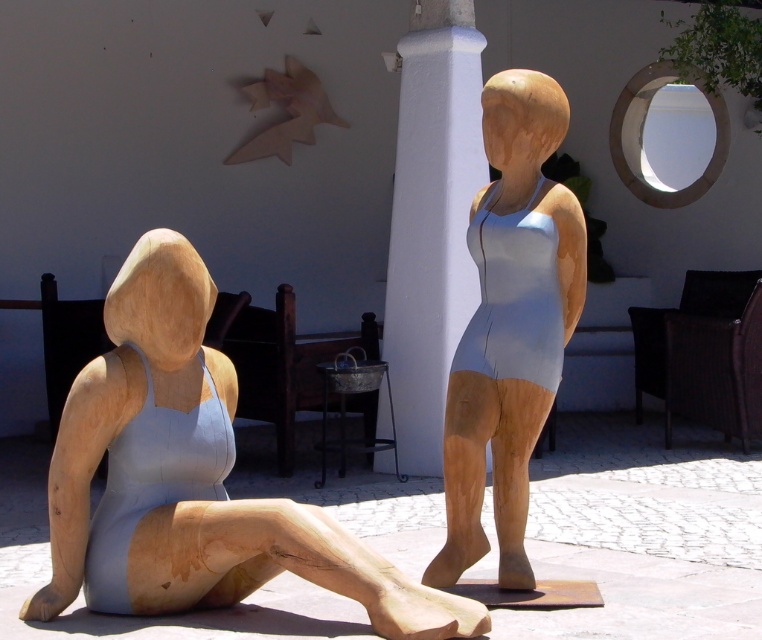
Is point (117, 417) more distant than point (402, 262)?

No, it is in front of (402, 262).

Does matte wood figure at left come in front of white painted pillar at center?

Yes, matte wood figure at left is in front of white painted pillar at center.

What do you see at coordinates (191, 477) in the screenshot? I see `matte wood figure at left` at bounding box center [191, 477].

Find the location of a particular element. This screenshot has width=762, height=640. matte wood figure at left is located at coordinates (191, 477).

Can you confirm if matte wood statue at center is wider than white painted pillar at center?

In fact, matte wood statue at center might be narrower than white painted pillar at center.

Can you confirm if matte wood statue at center is positioned below white painted pillar at center?

Indeed, matte wood statue at center is positioned under white painted pillar at center.

What do you see at coordinates (508, 326) in the screenshot?
I see `matte wood statue at center` at bounding box center [508, 326].

Find the location of a particular element. Image resolution: width=762 pixels, height=640 pixels. matte wood statue at center is located at coordinates (508, 326).

Between matte wood figure at left and matte wood statue at center, which one has more height?

Standing taller between the two is matte wood statue at center.

Is point (141, 358) closer to viewer compared to point (476, 420)?

Yes, point (141, 358) is in front of point (476, 420).

Is point (111, 420) positioned behind point (549, 228)?

No, (111, 420) is closer to viewer.

Image resolution: width=762 pixels, height=640 pixels. I want to click on matte wood figure at left, so click(191, 477).